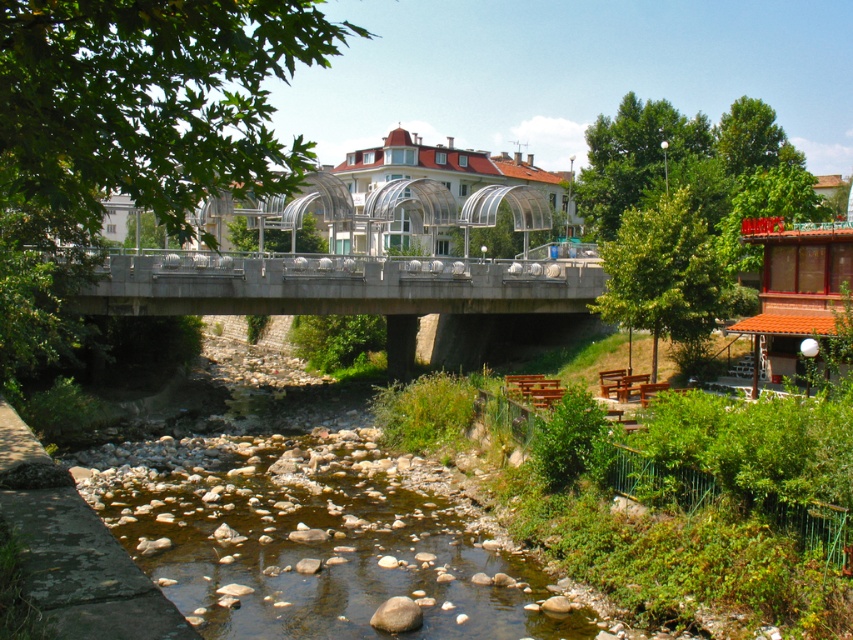
Does concrete bridge at center have a smaller size compared to green leafy tree at lower right?

Correct, concrete bridge at center occupies less space than green leafy tree at lower right.

Identify the location of concrete bridge at center. (335, 284).

Where is `concrete bridge at center`? The width and height of the screenshot is (853, 640). concrete bridge at center is located at coordinates (335, 284).

Can you confirm if green leafy tree at center is positioned to the left of concrete bridge at center?

Yes, green leafy tree at center is to the left of concrete bridge at center.

Between point (64, 112) and point (233, 260), which one is positioned behind?

The point (233, 260) is more distant.

Identify the location of green leafy tree at center. Image resolution: width=853 pixels, height=640 pixels. (149, 100).

Is point (347, 266) less distant than point (636, 205)?

Yes, it is in front of point (636, 205).

Which is above, concrete bridge at center or green leafy tree at upper right?

green leafy tree at upper right is above.

You are a GUI agent. You are given a task and a screenshot of the screen. Output one action in this format:
    pyautogui.click(x=<x>, y=<y>)
    Task: Click on the concrete bridge at center
    This screenshot has height=640, width=853.
    Given the screenshot: What is the action you would take?
    pyautogui.click(x=335, y=284)